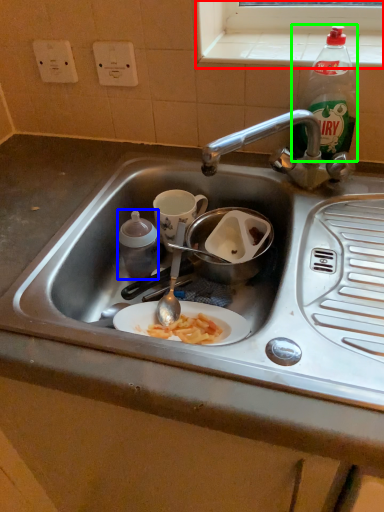
Question: Based on their relative distances, which object is nearer to window sill (highlighted by a red box)? Choose from bottle (highlighted by a blue box) and bottle (highlighted by a green box).

Choices:
 (A) bottle
 (B) bottle

Answer: (B)